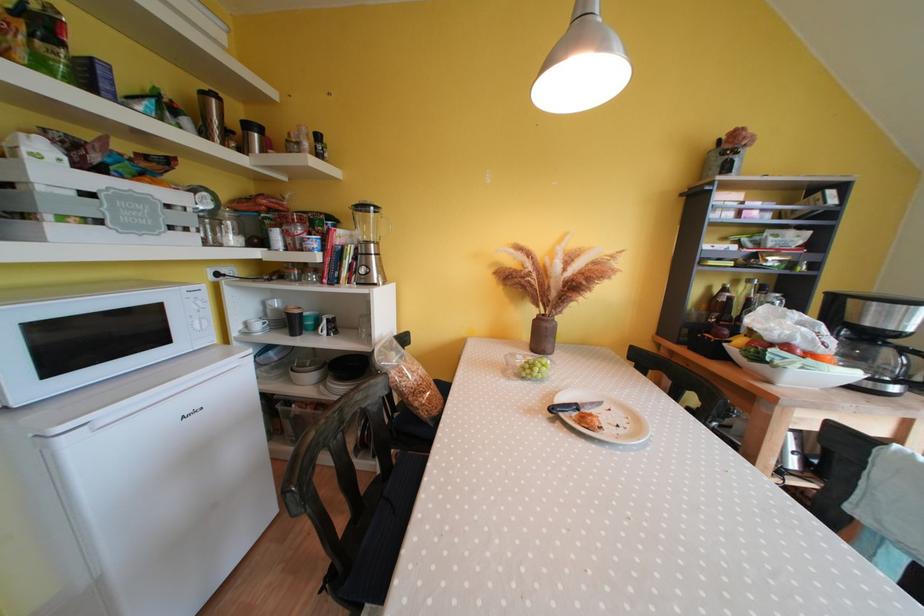
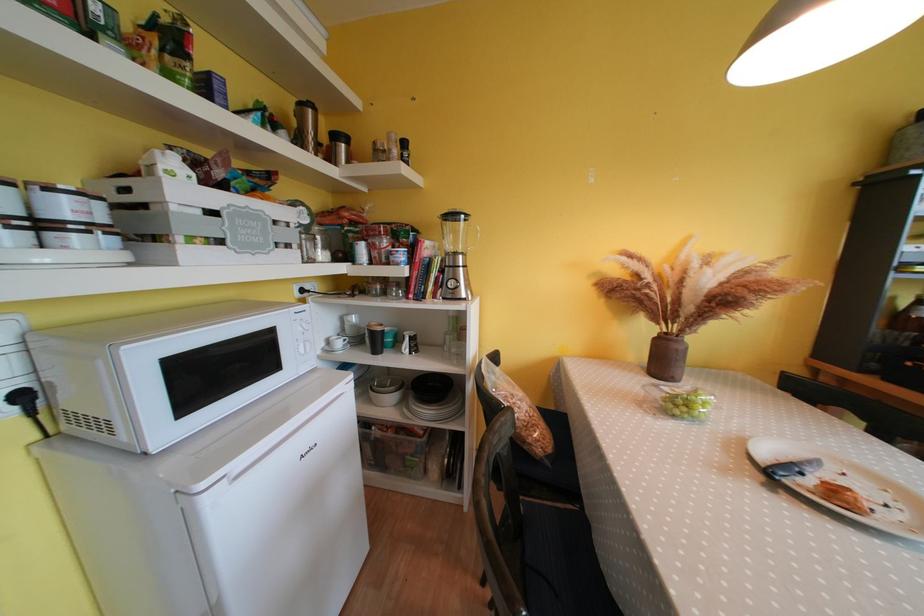
Where in the second image is the point corresponding to (357,269) from the first image?

(444, 282)